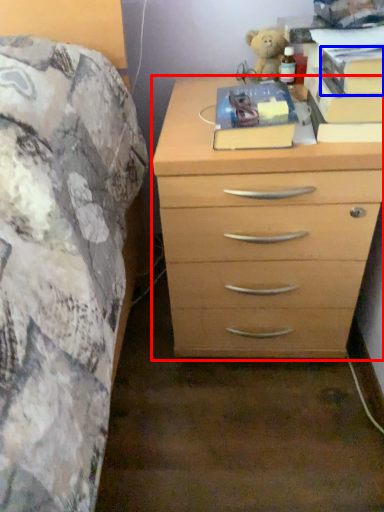
Question: Which object appears closest to the camera in this image, chest of drawers (highlighted by a red box) or paperback book (highlighted by a blue box)?

Choices:
 (A) chest of drawers
 (B) paperback book

Answer: (B)